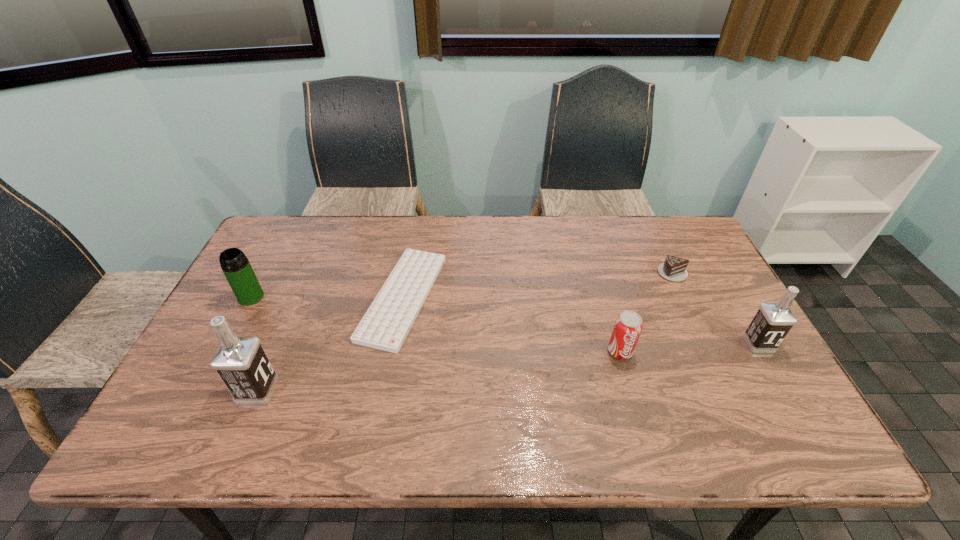
Find the location of a particular element. The width and height of the screenshot is (960, 540). empty space that is in between the fifth object from right to left and the fifth object from left to right is located at coordinates 465,331.

In order to click on vacant point located between the computer keyboard and the third shortest object in this screenshot , I will do `click(512, 324)`.

Image resolution: width=960 pixels, height=540 pixels. I want to click on unoccupied area between the fourth tallest object and the leftmost object, so click(x=436, y=324).

This screenshot has height=540, width=960. I want to click on free space between the computer keyboard and the right vodka, so click(x=581, y=320).

Where is `unoccupied area between the leftmost object and the fifth tallest object`? The width and height of the screenshot is (960, 540). unoccupied area between the leftmost object and the fifth tallest object is located at coordinates pyautogui.click(x=462, y=285).

Find the location of a particular element. Image resolution: width=960 pixels, height=540 pixels. free area in between the thermos bottle and the soda can is located at coordinates (436, 324).

Locate an element on the screen. This screenshot has height=540, width=960. vacant area that lies between the fourth tallest object and the shorter vodka is located at coordinates (689, 347).

I want to click on the fourth closest object to the taller vodka, so click(x=674, y=269).

Identify which object is the third closest to the leftmost object. Please provide its 2D coordinates. Your answer should be formatted as a tuple, i.e. [(x, y)], where the tuple contains the x and y coordinates of a point satisfying the conditions above.

[(628, 326)]

The image size is (960, 540). Identify the location of free space that satisfies the following two spatial constraints: 1. from the spout of the thermos bottle; 2. on the right side of the computer keyboard. (251, 297).